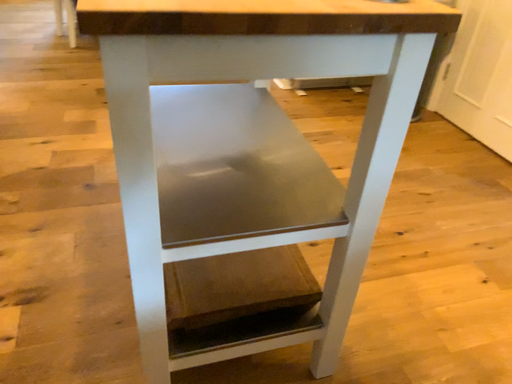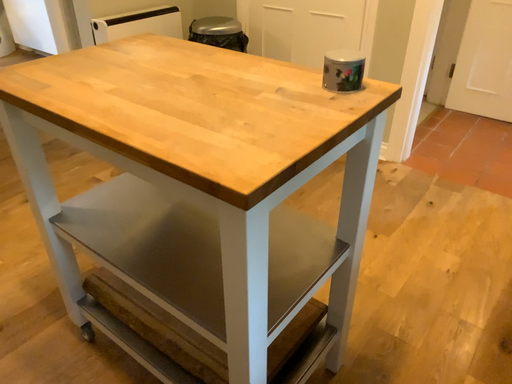
Question: How did the camera likely rotate when shooting the video?

Choices:
 (A) rotated downward
 (B) rotated upward

Answer: (B)